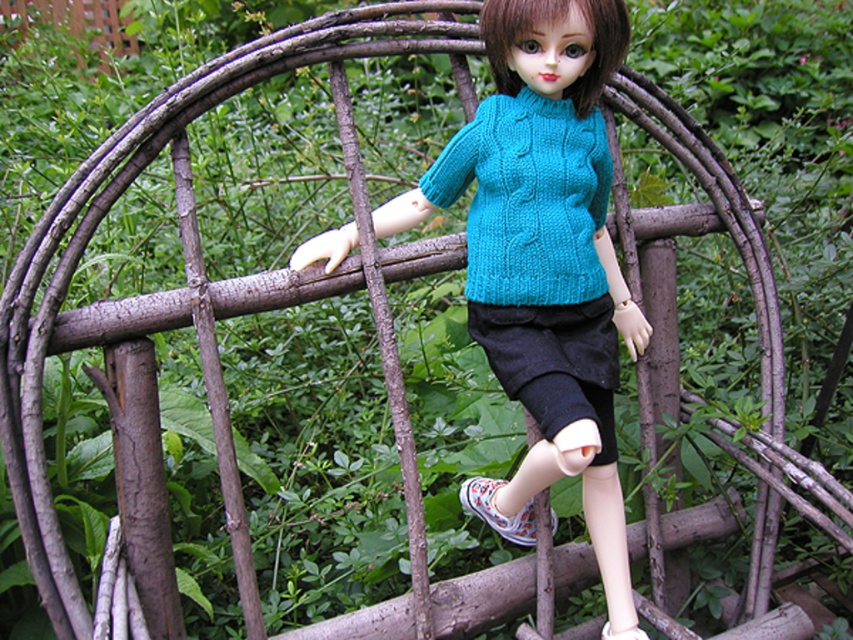
You are a gardener trying to place a decorative rock between the white canvas shoe at lower center and the white fabric shoe at lower right. The rock is 5 inches wide. Is there enough space between them to fit the rock?

The white canvas shoe at lower center and white fabric shoe at lower right are 8.47 inches apart. Since the rock is 5 inches wide, there is enough space between them to fit the rock.

You are a gardener in the scene and need to place a new plant between the white canvas shoe at lower center and the white fabric shoe at lower right. Based on their positions, which shoe should the plant be closer to?

The plant should be placed closer to the white fabric shoe at lower right because the white canvas shoe at lower center is to the left of it, so the space between them is on the right side of the canvas shoe.